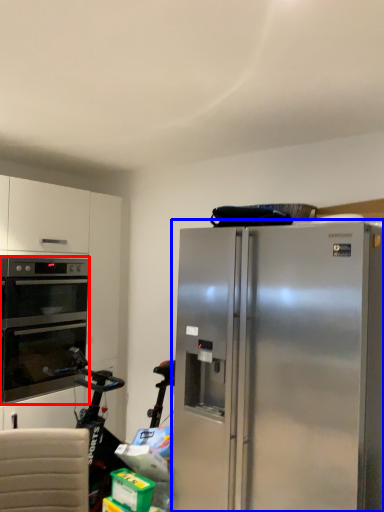
Question: Among these objects, which one is farthest to the camera, oven (highlighted by a red box) or refrigerator (highlighted by a blue box)?

Choices:
 (A) oven
 (B) refrigerator

Answer: (A)